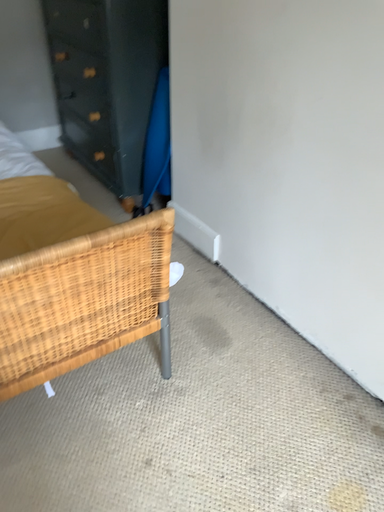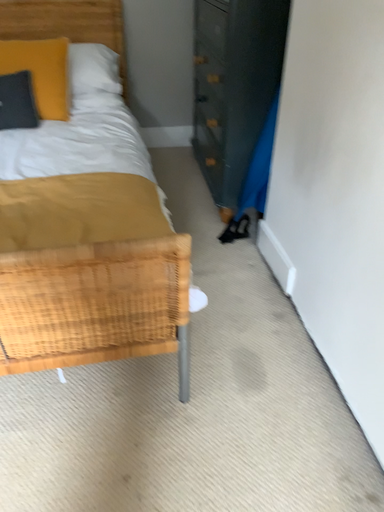
Question: How did the camera likely rotate when shooting the video?

Choices:
 (A) rotated left
 (B) rotated right

Answer: (A)